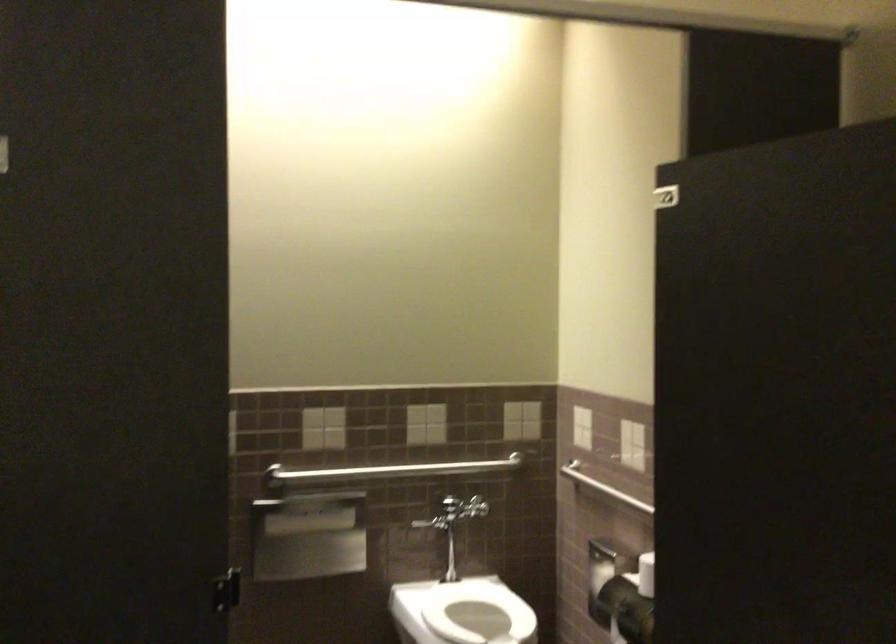
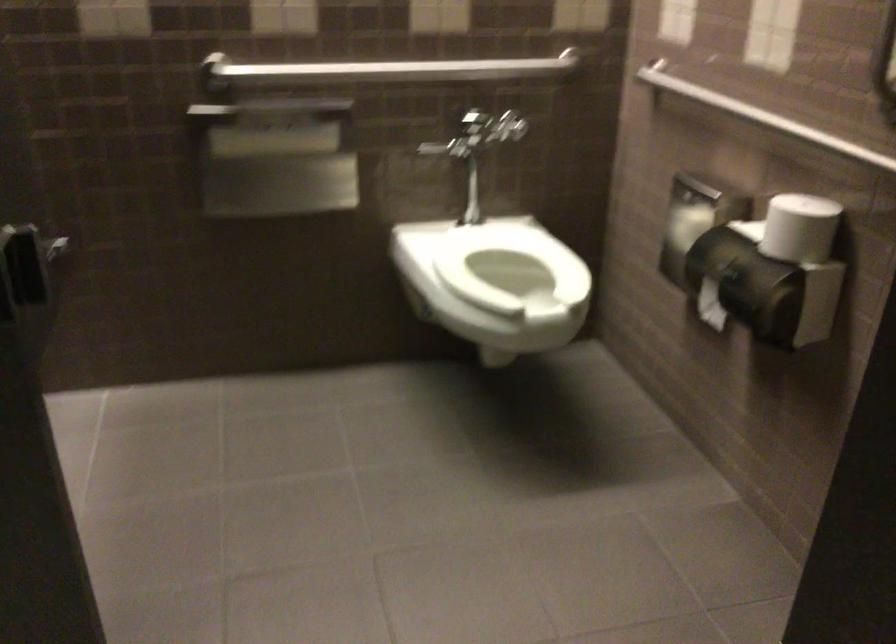
Find the pixel in the second image that matches [634,500] in the first image.

(761, 116)